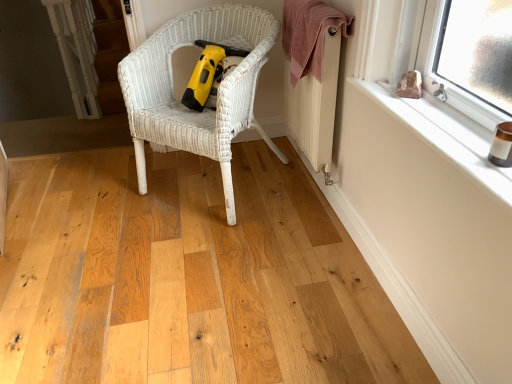
Question: Is white painted wood at upper right in front of white wicker chair at center?

Choices:
 (A) yes
 (B) no

Answer: (A)

Question: Does white painted wood at upper right have a lesser width compared to white wicker chair at center?

Choices:
 (A) yes
 (B) no

Answer: (A)

Question: Is white painted wood at upper right to the right of white wicker chair at center from the viewer's perspective?

Choices:
 (A) no
 (B) yes

Answer: (B)

Question: Does white painted wood at upper right have a larger size compared to white wicker chair at center?

Choices:
 (A) no
 (B) yes

Answer: (A)

Question: Is white painted wood at upper right beside white wicker chair at center?

Choices:
 (A) no
 (B) yes

Answer: (A)

Question: Do you think white textured radiator at upper right is within pink towel at upper right, or outside of it?

Choices:
 (A) inside
 (B) outside

Answer: (A)

Question: Considering their positions, is white textured radiator at upper right located in front of or behind pink towel at upper right?

Choices:
 (A) behind
 (B) front

Answer: (A)

Question: Considering the positions of white textured radiator at upper right and pink towel at upper right in the image, is white textured radiator at upper right bigger or smaller than pink towel at upper right?

Choices:
 (A) big
 (B) small

Answer: (A)

Question: Looking at their shapes, would you say white textured radiator at upper right is wider or thinner than pink towel at upper right?

Choices:
 (A) wide
 (B) thin

Answer: (B)

Question: From their relative heights in the image, would you say white painted wood at upper right is taller or shorter than white wicker chair at center?

Choices:
 (A) short
 (B) tall

Answer: (A)

Question: Is white painted wood at upper right inside or outside of white wicker chair at center?

Choices:
 (A) inside
 (B) outside

Answer: (B)

Question: From a real-world perspective, is white painted wood at upper right physically located above or below white wicker chair at center?

Choices:
 (A) above
 (B) below

Answer: (A)

Question: From the image's perspective, is white painted wood at upper right above or below white wicker chair at center?

Choices:
 (A) below
 (B) above

Answer: (A)

Question: Considering the positions of yellow plastic vacuum at center and white wicker chair at center in the image, is yellow plastic vacuum at center wider or thinner than white wicker chair at center?

Choices:
 (A) thin
 (B) wide

Answer: (A)

Question: Considering the positions of yellow plastic vacuum at center and white wicker chair at center in the image, is yellow plastic vacuum at center taller or shorter than white wicker chair at center?

Choices:
 (A) tall
 (B) short

Answer: (B)